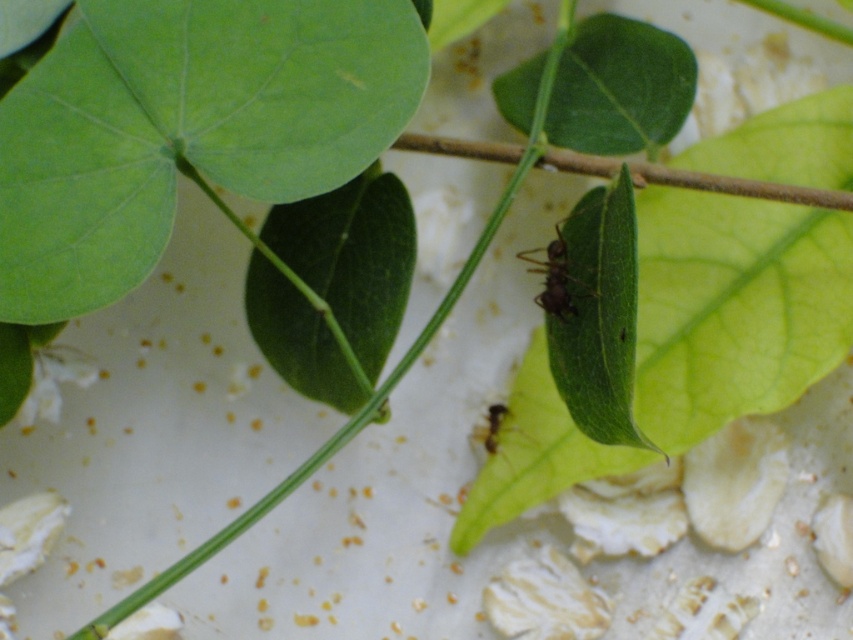
Is brown matte ant at center wider than green matte ant at center?

Indeed, brown matte ant at center has a greater width compared to green matte ant at center.

You are a GUI agent. You are given a task and a screenshot of the screen. Output one action in this format:
    pyautogui.click(x=<x>, y=<y>)
    Task: Click on the brown matte ant at center
    The height and width of the screenshot is (640, 853).
    Given the screenshot: What is the action you would take?
    pyautogui.click(x=556, y=280)

Does green matte leaf at center lie in front of green matte ant at center?

Yes, it is in front of green matte ant at center.

Measure the distance from green matte leaf at center to green matte ant at center.

green matte leaf at center is 20.01 centimeters away from green matte ant at center.

This screenshot has width=853, height=640. Find the location of `green matte leaf at center`. green matte leaf at center is located at coordinates (598, 316).

Is green matte leaf at center to the left of brown matte ant at center from the viewer's perspective?

Incorrect, green matte leaf at center is not on the left side of brown matte ant at center.

Does green matte leaf at center lie in front of brown matte ant at center?

Yes, green matte leaf at center is closer to the viewer.

Is point (560, 392) behind point (547, 272)?

Yes, it is behind point (547, 272).

You are a GUI agent. You are given a task and a screenshot of the screen. Output one action in this format:
    pyautogui.click(x=<x>, y=<y>)
    Task: Click on the green matte leaf at center
    Image resolution: width=853 pixels, height=640 pixels.
    Given the screenshot: What is the action you would take?
    pyautogui.click(x=598, y=316)